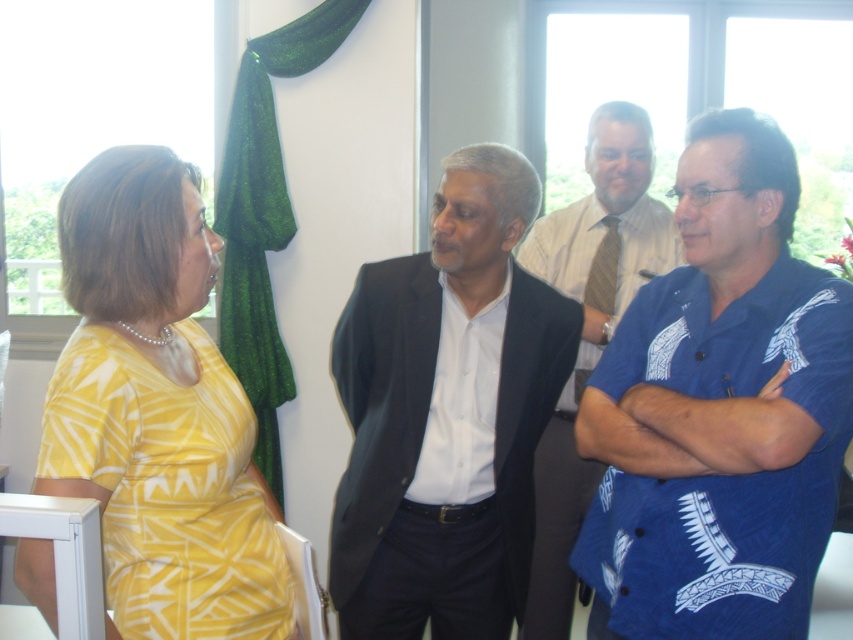
Is blue printed shirt at center wider than dark gray suit at center?

No.

Between blue printed shirt at center and dark gray suit at center, which one appears on the right side from the viewer's perspective?

From the viewer's perspective, blue printed shirt at center appears more on the right side.

Between point (776, 292) and point (575, 332), which one is positioned in front?

Positioned in front is point (776, 292).

Identify the location of blue printed shirt at center. Image resolution: width=853 pixels, height=640 pixels. (718, 412).

Can you confirm if dark gray suit at center is positioned below yellow printed dress at left?

Yes.

Consider the image. Who is lower down, dark gray suit at center or yellow printed dress at left?

dark gray suit at center

Which is behind, point (404, 336) or point (114, 544)?

Point (404, 336)

Where is `dark gray suit at center`? The height and width of the screenshot is (640, 853). dark gray suit at center is located at coordinates (447, 413).

Measure the distance between dark gray suit at center and white shirt at center.

The distance of dark gray suit at center from white shirt at center is 20.52 inches.

Find the location of a particular element. dark gray suit at center is located at coordinates (447, 413).